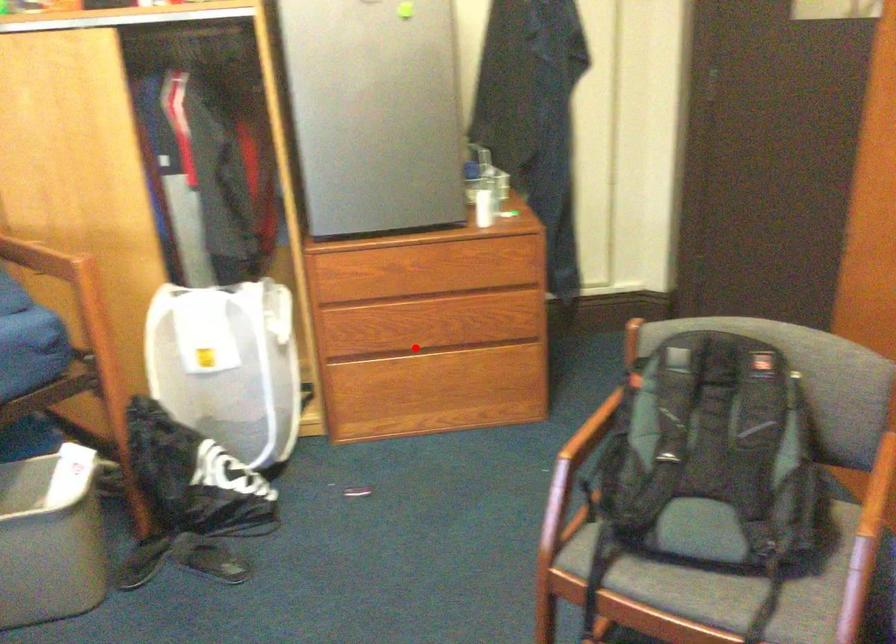
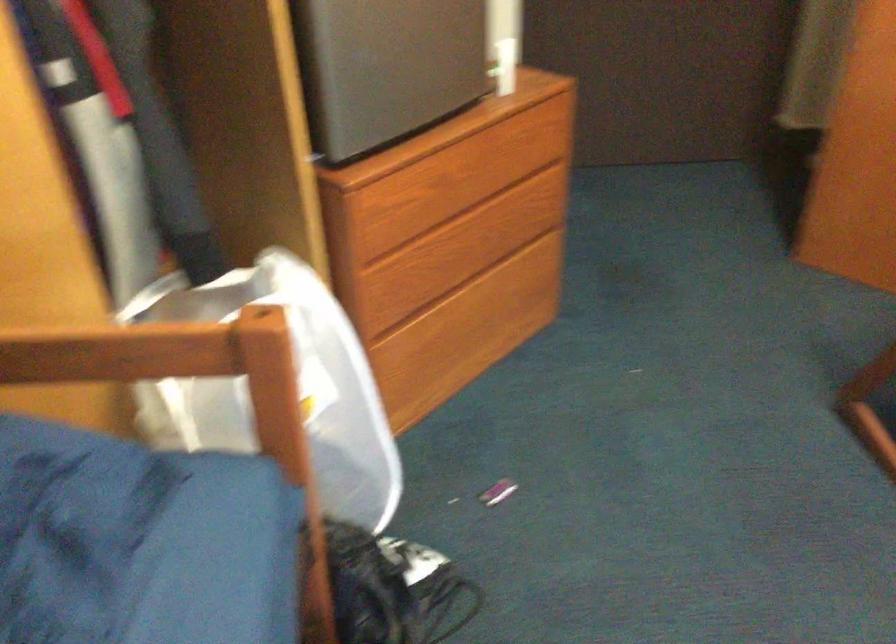
Find the pixel in the second image that matches the highlighted location in the first image.

(451, 279)